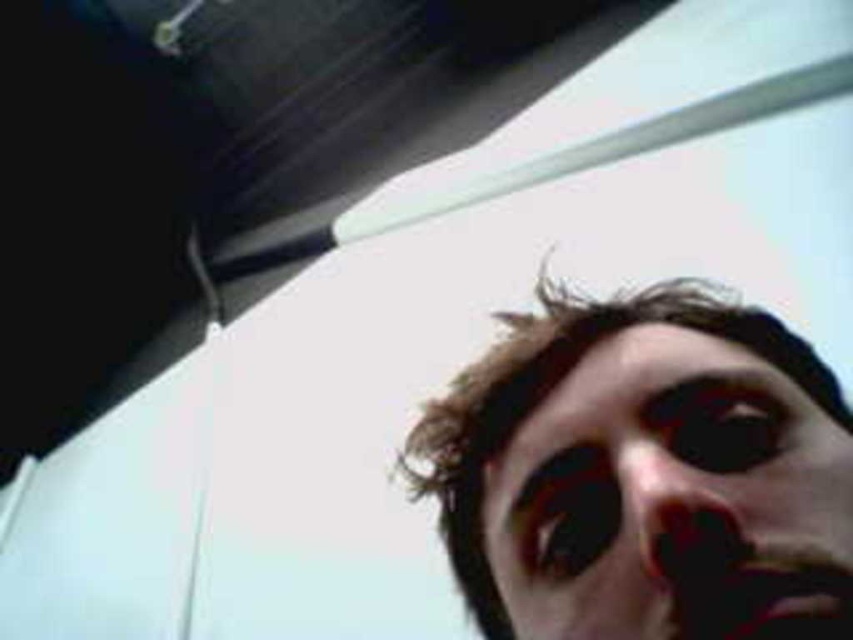
Question: Does smooth skin face at bottom right lie behind smooth skin nose at center?

Choices:
 (A) yes
 (B) no

Answer: (B)

Question: Is smooth skin face at bottom right wider than smooth skin nose at center?

Choices:
 (A) no
 (B) yes

Answer: (B)

Question: Is smooth skin face at bottom right behind smooth skin nose at center?

Choices:
 (A) yes
 (B) no

Answer: (B)

Question: Which point is farther from the camera taking this photo?

Choices:
 (A) (694, 458)
 (B) (641, 634)

Answer: (A)